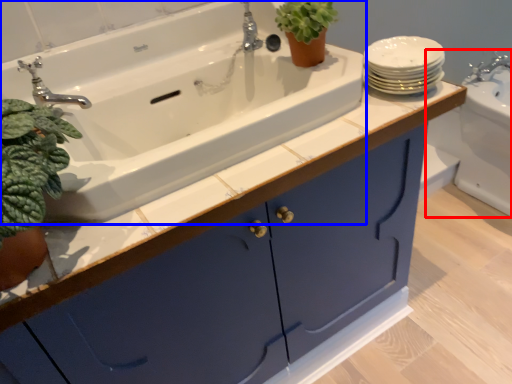
Question: Which of the following is the farthest to the observer, sink (highlighted by a red box) or sink (highlighted by a blue box)?

Choices:
 (A) sink
 (B) sink

Answer: (A)